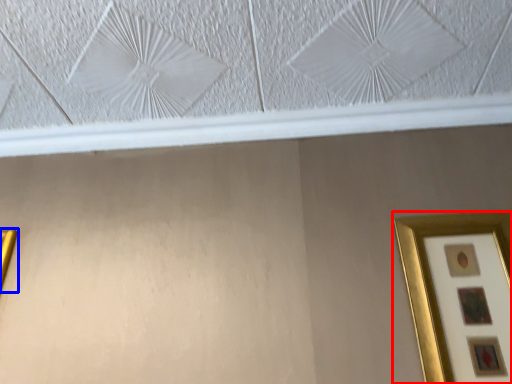
Question: Which of the following is the farthest to the observer, picture frame (highlighted by a red box) or picture frame (highlighted by a blue box)?

Choices:
 (A) picture frame
 (B) picture frame

Answer: (B)